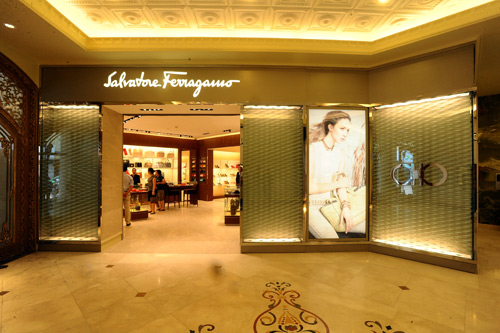
You are a GUI agent. You are given a task and a screenshot of the screen. Output one action in this format:
    pyautogui.click(x=<x>, y=<y>)
    Task: Click on the floor
    
    Given the screenshot: What is the action you would take?
    pyautogui.click(x=163, y=290)